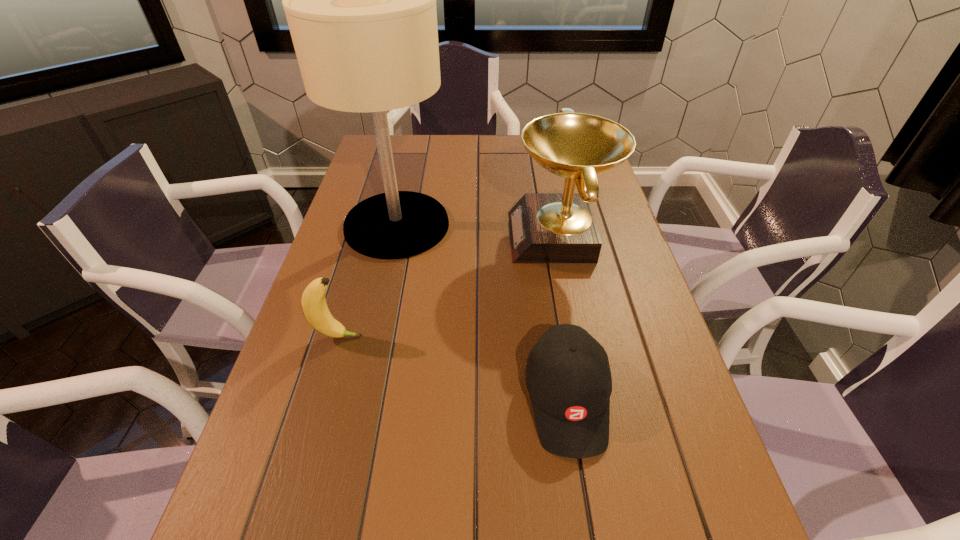
The image size is (960, 540). I want to click on table lamp, so click(360, 0).

Identify the location of the second tallest object. (544, 227).

Find the location of `the third farthest object`. the third farthest object is located at coordinates (313, 301).

Find the location of `banana`. banana is located at coordinates (313, 301).

Identify the location of baseball cap. This screenshot has width=960, height=540. (568, 377).

Image resolution: width=960 pixels, height=540 pixels. Identify the location of the nearest object. (568, 377).

Identify the location of vacant space situated 0.180m on the front of the table lamp. (377, 312).

At what (x,y) coordinates should I click in order to perform the action: click on free region located on the front-facing side of the award. Please return your answer as a coordinate pair (x, y). This screenshot has height=540, width=960. Looking at the image, I should click on (372, 237).

This screenshot has width=960, height=540. In order to click on free location located 0.160m on the front-facing side of the award in this screenshot , I will do `click(451, 237)`.

Locate an element on the screen. The height and width of the screenshot is (540, 960). free space located on the front-facing side of the award is located at coordinates (386, 237).